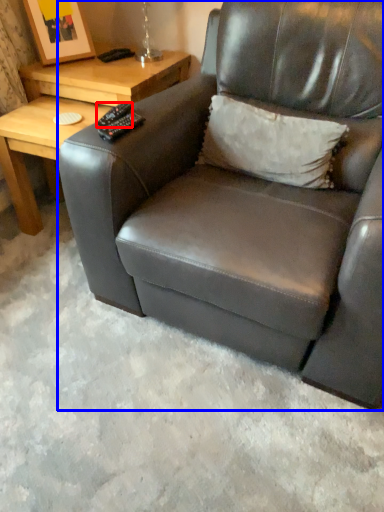
Question: Which object appears farthest to the camera in this image, remote (highlighted by a red box) or chair (highlighted by a blue box)?

Choices:
 (A) remote
 (B) chair

Answer: (A)